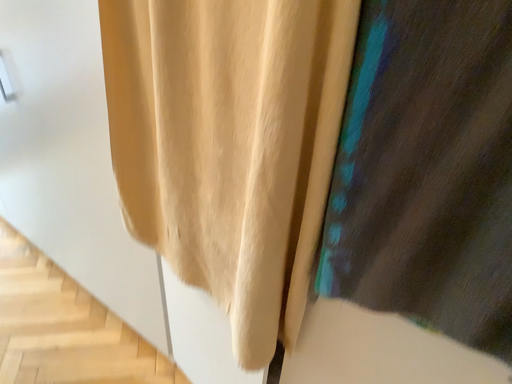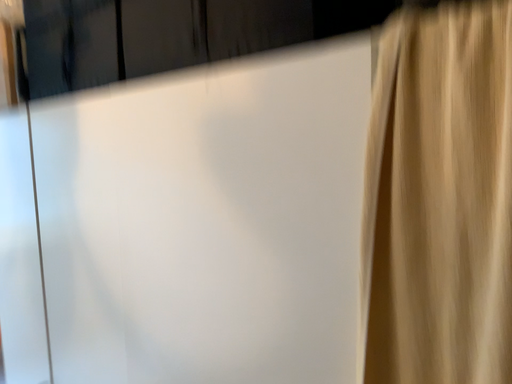
Question: Which way did the camera rotate in the video?

Choices:
 (A) rotated right
 (B) rotated left

Answer: (B)